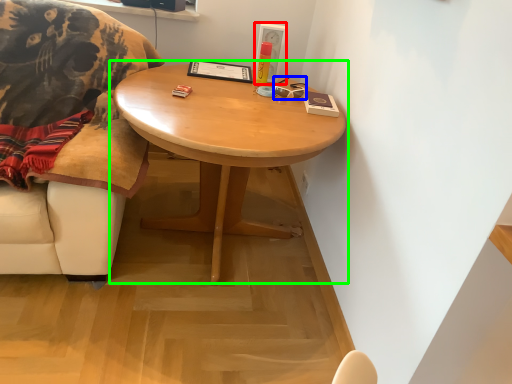
Question: Which object is positioned farthest from picture frame (highlighted by a red box)? Select from glasses (highlighted by a blue box) and coffee table (highlighted by a green box).

Choices:
 (A) glasses
 (B) coffee table

Answer: (B)